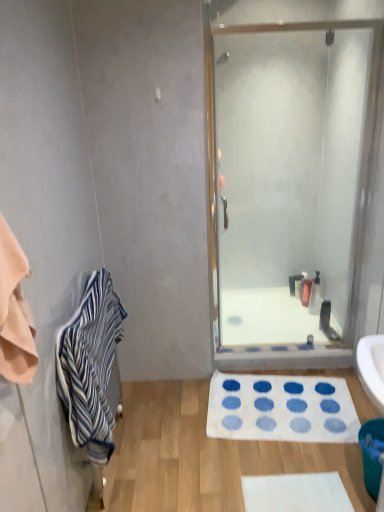
Question: Is blue striped towel at left not inside teal plastic trash can at lower right?

Choices:
 (A) yes
 (B) no

Answer: (A)

Question: Considering the relative sizes of blue striped towel at left and teal plastic trash can at lower right in the image provided, is blue striped towel at left shorter than teal plastic trash can at lower right?

Choices:
 (A) no
 (B) yes

Answer: (A)

Question: Is blue striped towel at left in front of teal plastic trash can at lower right?

Choices:
 (A) no
 (B) yes

Answer: (B)

Question: Is teal plastic trash can at lower right inside blue striped towel at left?

Choices:
 (A) no
 (B) yes

Answer: (A)

Question: Does blue striped towel at left have a greater height compared to teal plastic trash can at lower right?

Choices:
 (A) yes
 (B) no

Answer: (A)

Question: Can you confirm if blue striped towel at left is wider than teal plastic trash can at lower right?

Choices:
 (A) no
 (B) yes

Answer: (B)

Question: From the image's perspective, is clear glass shower door at center over teal plastic trash can at lower right?

Choices:
 (A) yes
 (B) no

Answer: (A)

Question: Considering the relative sizes of clear glass shower door at center and teal plastic trash can at lower right in the image provided, is clear glass shower door at center shorter than teal plastic trash can at lower right?

Choices:
 (A) yes
 (B) no

Answer: (B)

Question: Considering the relative sizes of clear glass shower door at center and teal plastic trash can at lower right in the image provided, is clear glass shower door at center taller than teal plastic trash can at lower right?

Choices:
 (A) yes
 (B) no

Answer: (A)

Question: From a real-world perspective, is clear glass shower door at center below teal plastic trash can at lower right?

Choices:
 (A) no
 (B) yes

Answer: (A)

Question: Can you confirm if clear glass shower door at center is bigger than teal plastic trash can at lower right?

Choices:
 (A) no
 (B) yes

Answer: (B)

Question: Is clear glass shower door at center next to teal plastic trash can at lower right?

Choices:
 (A) no
 (B) yes

Answer: (A)

Question: From the image's perspective, is clear glass shower door at center under white glossy bath at center?

Choices:
 (A) no
 (B) yes

Answer: (A)